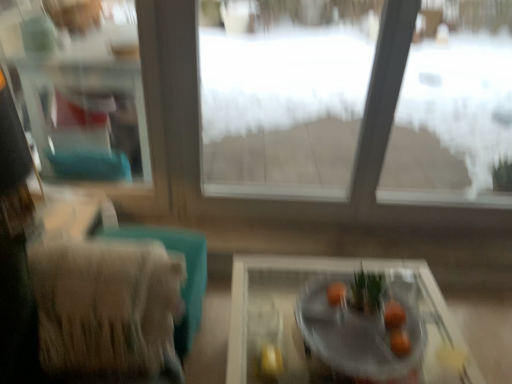
Locate an element on the screen. This screenshot has height=384, width=512. free space to the left of orange matte at center is located at coordinates (334, 329).